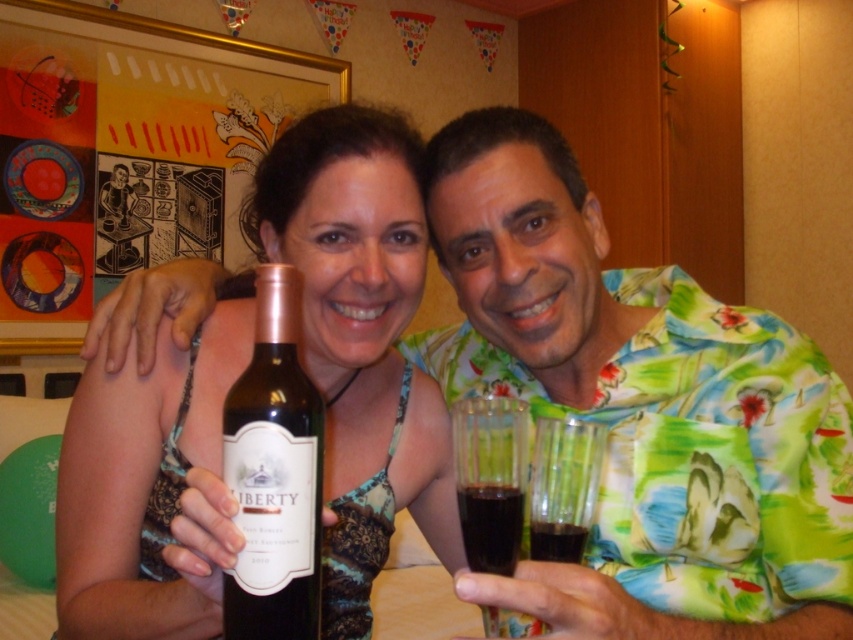
You are a bartender preparing drinks for a party. You have a matte glass bottle at center and dark red liquid at center on the counter. Which item is located to the left of the other?

The matte glass bottle at center is positioned on the left side of dark red liquid at center, so the matte glass bottle at center is to the left of the dark red liquid at center.

Based on the photo, you are a bartender preparing drinks for a party. You have two glasses in front of you, the transparent plastic glass at lower center and the transparent plastic wine glass at lower center. Which glass is positioned more to the left?

The transparent plastic glass at lower center is positioned more to the left than the transparent plastic wine glass at lower center.